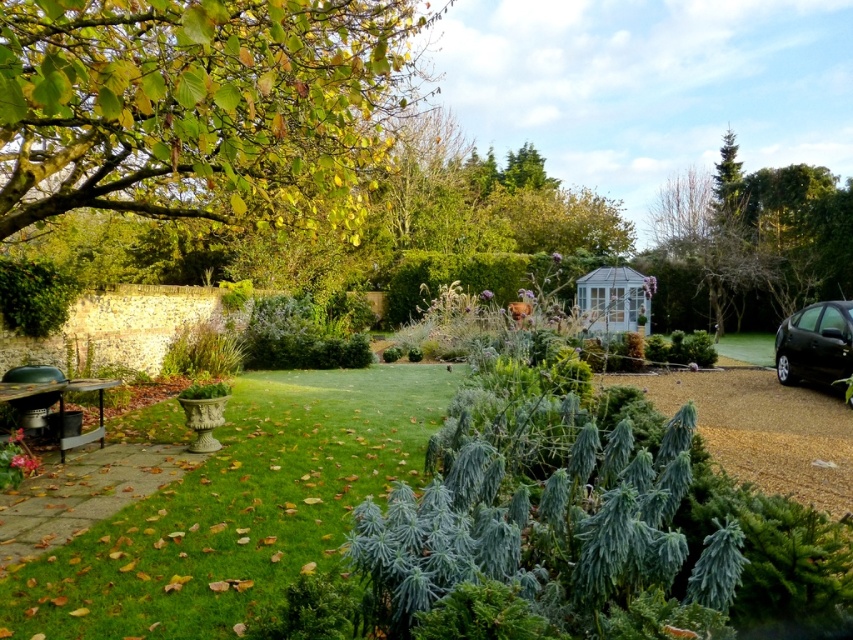
Question: Can you confirm if green leafy tree at upper left is smaller than green grass at lower left?

Choices:
 (A) yes
 (B) no

Answer: (B)

Question: Which point is farther from the camera taking this photo?

Choices:
 (A) (136, 184)
 (B) (140, 556)

Answer: (A)

Question: Observing the image, what is the correct spatial positioning of green leafy tree at upper left in reference to green grass at lower left?

Choices:
 (A) above
 (B) below

Answer: (A)

Question: Is green leafy tree at upper left positioned behind green grass at lower left?

Choices:
 (A) yes
 (B) no

Answer: (B)

Question: Considering the real-world distances, which object is farthest from the black metallic car at right?

Choices:
 (A) green grass at lower left
 (B) green leafy tree at upper left

Answer: (A)

Question: Which of the following is the closest to the observer?

Choices:
 (A) green grass at lower left
 (B) black metallic car at right
 (C) green leafy tree at upper left

Answer: (C)